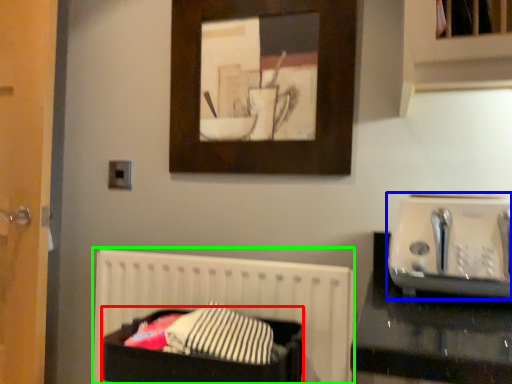
Question: Considering the real-world distances, which object is closest to laundry basket (highlighted by a red box)? appliance (highlighted by a blue box) or bed (highlighted by a green box).

Choices:
 (A) appliance
 (B) bed

Answer: (B)